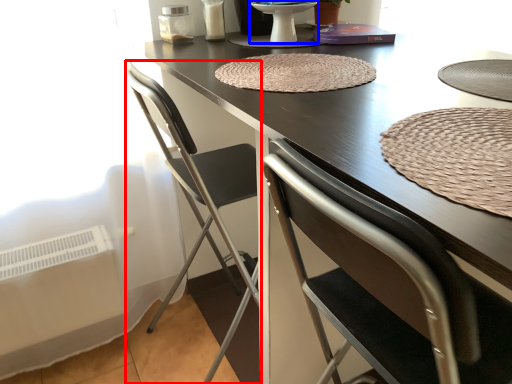
Question: Which object appears farthest to the camera in this image, chair (highlighted by a red box) or round table (highlighted by a blue box)?

Choices:
 (A) chair
 (B) round table

Answer: (B)